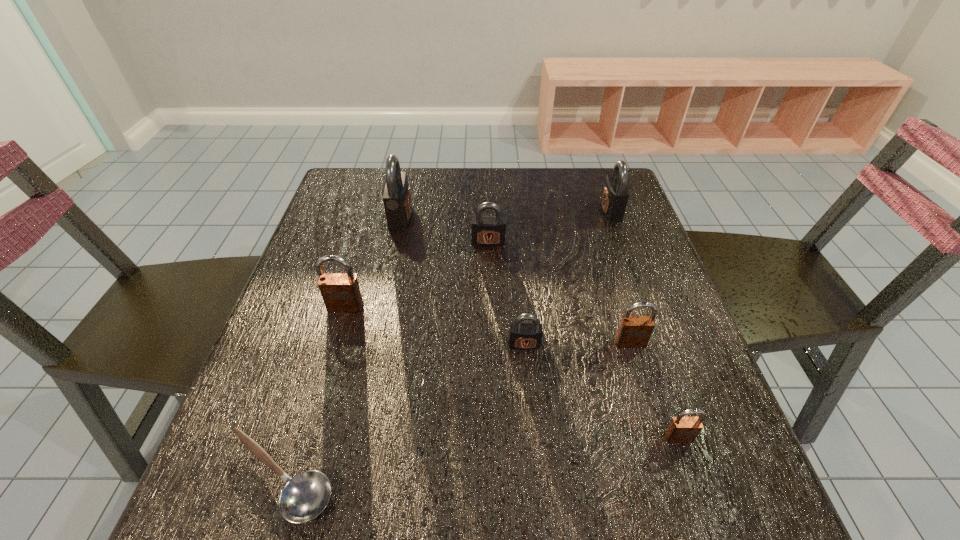
Where is `vacant point that satisfies the following two spatial constraints: 1. on the front of the second biggest gray padlock near the keyhole; 2. on the front-facing side of the second farthest brown padlock`? This screenshot has height=540, width=960. vacant point that satisfies the following two spatial constraints: 1. on the front of the second biggest gray padlock near the keyhole; 2. on the front-facing side of the second farthest brown padlock is located at coordinates [660, 343].

I want to click on free space that satisfies the following two spatial constraints: 1. on the front of the third smallest gray padlock near the keyhole; 2. on the front-facing side of the second nearest brown padlock, so pyautogui.click(x=660, y=343).

Locate an element on the screen. The width and height of the screenshot is (960, 540). free spot that satisfies the following two spatial constraints: 1. on the front of the third smallest gray padlock near the keyhole; 2. on the front of the fifth nearest padlock near the keyhole is located at coordinates (622, 242).

Locate an element on the screen. This screenshot has height=540, width=960. blank area in the image that satisfies the following two spatial constraints: 1. on the front of the second biggest gray padlock near the keyhole; 2. on the front-facing side of the second smallest brown padlock is located at coordinates (660, 343).

Locate an element on the screen. free space that satisfies the following two spatial constraints: 1. on the front of the third smallest gray padlock near the keyhole; 2. on the front side of the ladle is located at coordinates (708, 476).